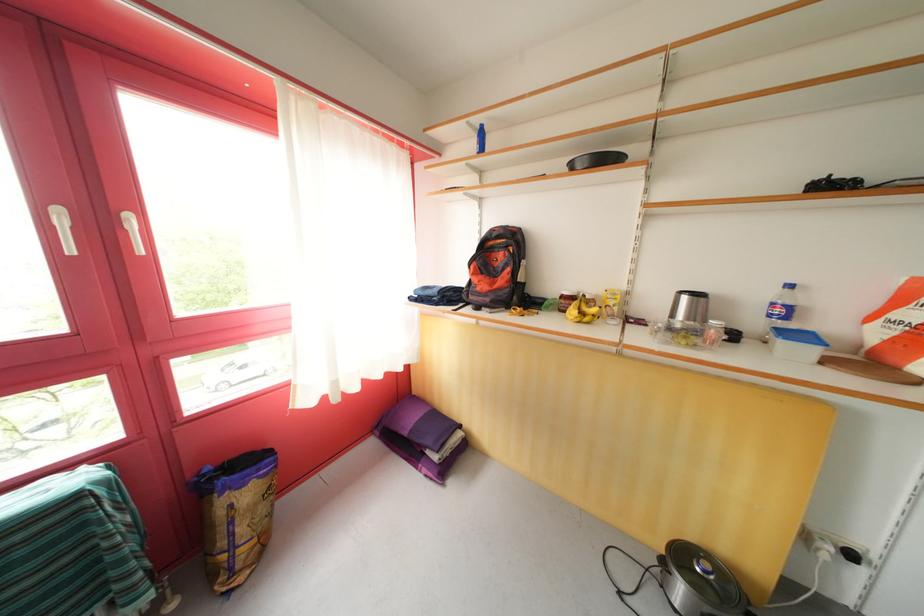
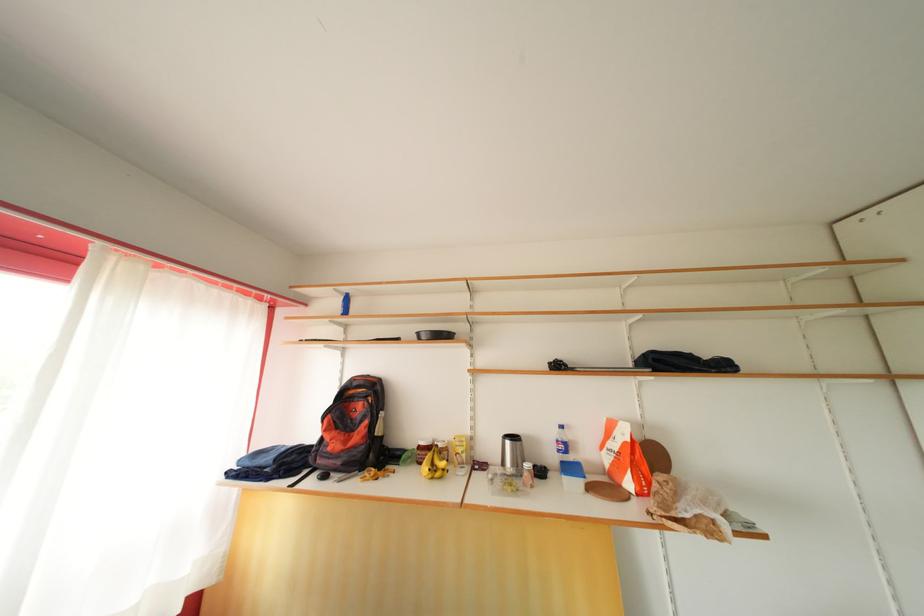
Find the pixel in the second image that matches point (821, 357) in the first image.

(587, 488)